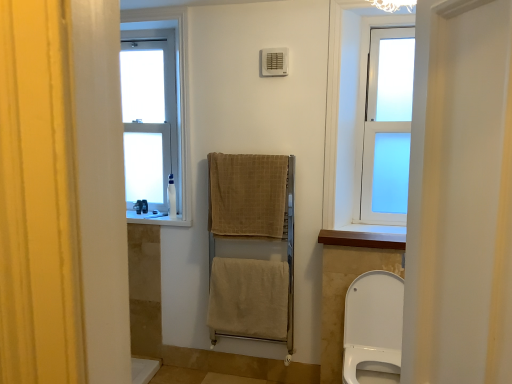
Find the location of a particular element. The image size is (512, 384). vacant point above beige woven towel at center, positioned as the 2th bath towel in bottom-to-top order (from a real-world perspective) is located at coordinates (251, 156).